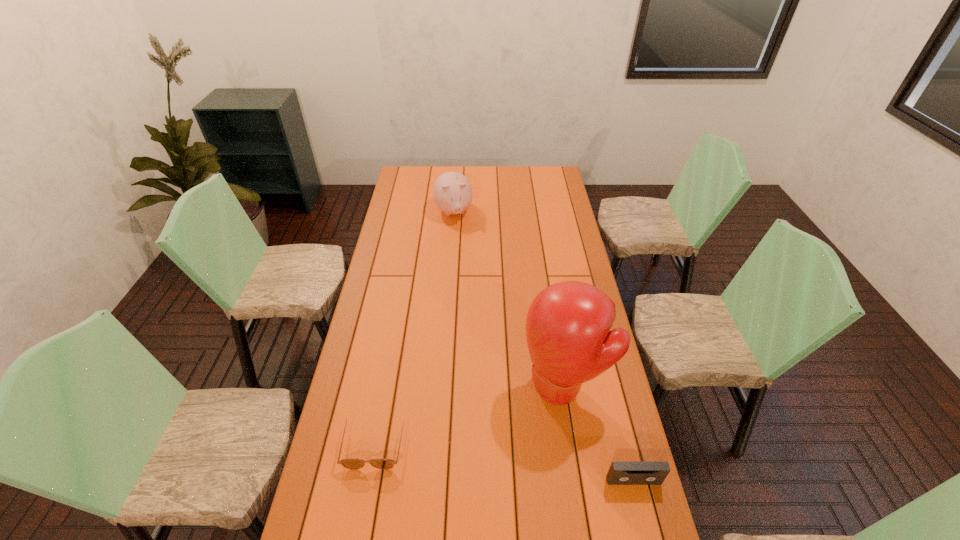
You are a GUI agent. You are given a task and a screenshot of the screen. Output one action in this format:
    pyautogui.click(x=<x>, y=<y>)
    Task: Click on the shortest object
    The width and height of the screenshot is (960, 540).
    Given the screenshot: What is the action you would take?
    pyautogui.click(x=351, y=463)

I want to click on the leftmost object, so click(x=351, y=463).

Identify the location of the second shortest object. (620, 473).

You are a GUI agent. You are given a task and a screenshot of the screen. Output one action in this format:
    pyautogui.click(x=<x>, y=<y>)
    Task: Click on the videotape
    
    Given the screenshot: What is the action you would take?
    pyautogui.click(x=620, y=473)

Locate an element on the screen. The width and height of the screenshot is (960, 540). piggy bank is located at coordinates (452, 191).

Find the location of a particular element. The width and height of the screenshot is (960, 540). the farthest object is located at coordinates (452, 191).

Image resolution: width=960 pixels, height=540 pixels. What are the coordinates of `the tallest object` in the screenshot? It's located at pyautogui.click(x=568, y=324).

This screenshot has width=960, height=540. I want to click on free space located 0.180m on the front-facing side of the shortest object, so click(357, 539).

The height and width of the screenshot is (540, 960). In order to click on vacant space located at the snout of the third shortest object in this screenshot , I will do pos(459,235).

The height and width of the screenshot is (540, 960). What are the coordinates of `free space located 0.320m at the snout of the third shortest object` in the screenshot? It's located at (469, 269).